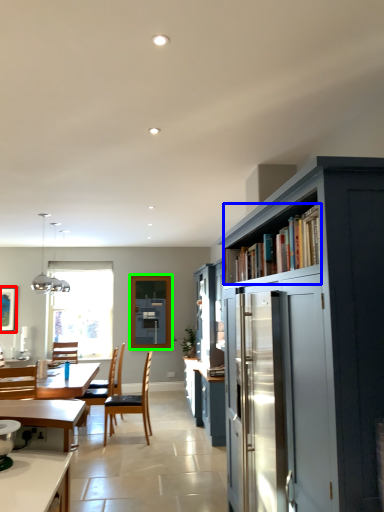
Question: Considering the real-world distances, which object is closest to picture frame (highlighted by a red box)? shelf (highlighted by a blue box) or window screen (highlighted by a green box).

Choices:
 (A) shelf
 (B) window screen

Answer: (B)